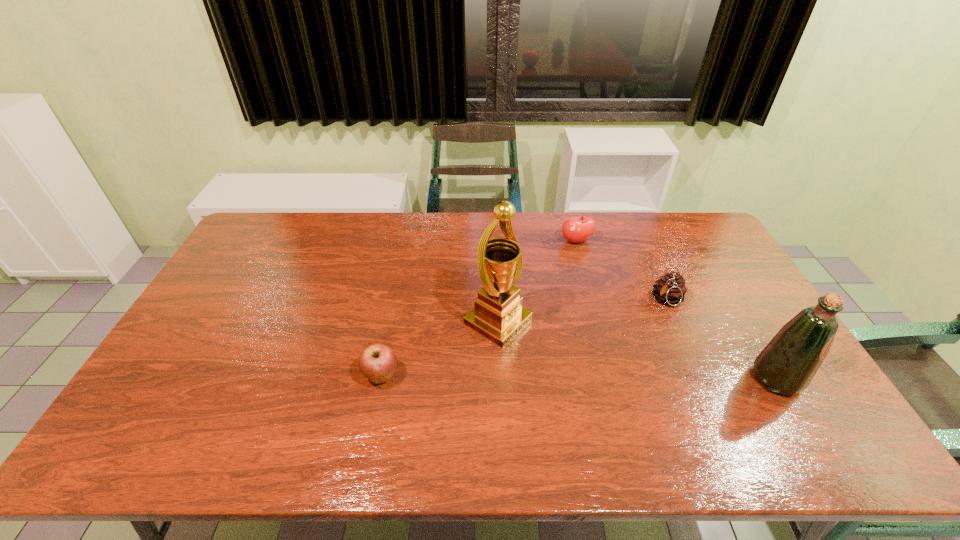
At what (x,y) coordinates should I click in order to perform the action: click on object identified as the second closest to the farthest object. Please return your answer as a coordinate pair (x, y). The image size is (960, 540). Looking at the image, I should click on (498, 315).

The height and width of the screenshot is (540, 960). I want to click on vacant space that satisfies the following two spatial constraints: 1. on the front side of the farther apple; 2. on the front-facing side of the rightmost object, so click(613, 379).

In order to click on free space that satisfies the following two spatial constraints: 1. on the back side of the pinecone; 2. on the right side of the nearer apple in this screenshot , I will do `click(396, 300)`.

At what (x,y) coordinates should I click in order to perform the action: click on blank space that satisfies the following two spatial constraints: 1. on the front side of the leftmost object; 2. on the front-facing side of the fourth shortest object. Please return your answer as a coordinate pair (x, y). This screenshot has height=540, width=960. Looking at the image, I should click on (380, 379).

Where is `free space that satisfies the following two spatial constraints: 1. on the back side of the tallest object; 2. on the left side of the third object from left to right`? This screenshot has width=960, height=540. free space that satisfies the following two spatial constraints: 1. on the back side of the tallest object; 2. on the left side of the third object from left to right is located at coordinates (494, 241).

I want to click on free space that satisfies the following two spatial constraints: 1. on the front side of the rightmost object; 2. on the front-facing side of the left apple, so click(x=380, y=379).